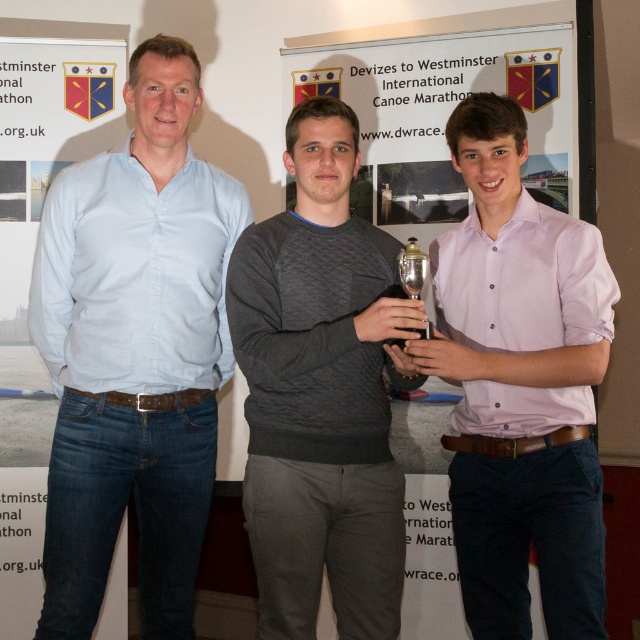
Based on the photo, you are organizing a photo shoot and need to ensure that the light blue shirt at left and the white paper at center are visible in the final image. Based on their positions, which object is closer to the camera?

The light blue shirt at left is closer to the camera because it is in front of the white paper at center.